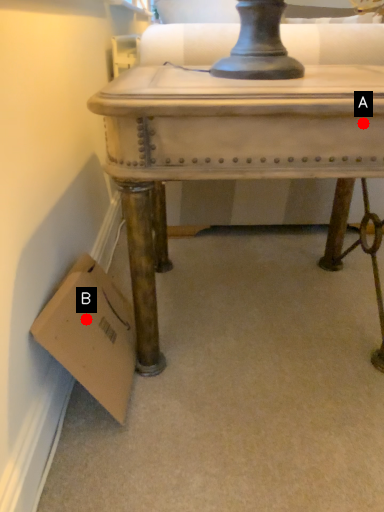
Question: Two points are circled on the image, labeled by A and B beside each circle. Among these points, which one is nearest to the camera?

Choices:
 (A) A is closer
 (B) B is closer

Answer: (A)